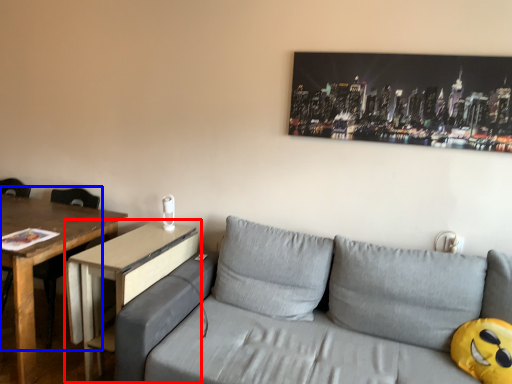
Question: Among these objects, which one is nearest to the camera, table (highlighted by a red box) or chair (highlighted by a blue box)?

Choices:
 (A) table
 (B) chair

Answer: (A)